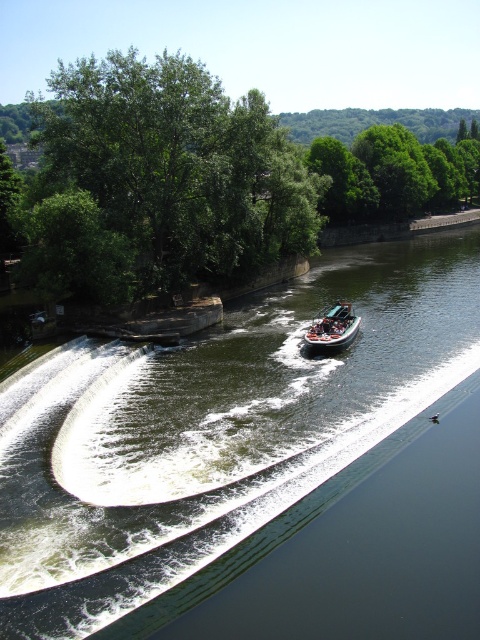
Question: Which of the following is the closest to the observer?

Choices:
 (A) orange fiberglass speedboat at center
 (B) green leafy tree at upper left
 (C) green leafy trees at upper center
 (D) green smooth water at center

Answer: (D)

Question: Which point is closer to the camera?

Choices:
 (A) green leafy tree at upper left
 (B) green smooth water at center

Answer: (B)

Question: In this image, where is green smooth water at center located relative to orange fiberglass speedboat at center?

Choices:
 (A) below
 (B) above

Answer: (A)

Question: Which of the following is the closest to the observer?

Choices:
 (A) (395, 152)
 (B) (11, 509)

Answer: (B)

Question: Is green smooth water at center above green leafy trees at upper center?

Choices:
 (A) yes
 (B) no

Answer: (B)

Question: Can you confirm if green leafy tree at upper left is positioned below orange fiberglass speedboat at center?

Choices:
 (A) yes
 (B) no

Answer: (B)